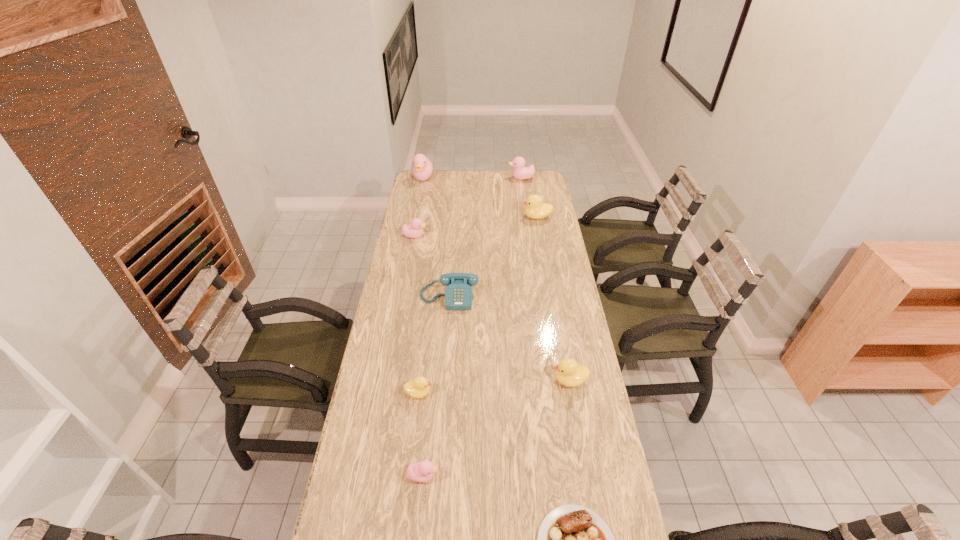
I want to click on free space at the far edge of the desktop, so click(x=466, y=172).

In order to click on vacant space at the left edge of the desktop in this screenshot , I will do `click(404, 346)`.

You are a GUI agent. You are given a task and a screenshot of the screen. Output one action in this format:
    pyautogui.click(x=<x>, y=<y>)
    Task: Click on the vacant space at the right edge of the desktop
    
    Given the screenshot: What is the action you would take?
    pyautogui.click(x=539, y=296)

This screenshot has height=540, width=960. In order to click on vacant space at the far left corner of the desktop in this screenshot , I will do `click(432, 188)`.

Image resolution: width=960 pixels, height=540 pixels. Identify the location of vacant region at the far right corner. (528, 182).

Locate an element on the screen. The height and width of the screenshot is (540, 960). vacant area between the second smallest yellow duckling and the fifth farthest object is located at coordinates (510, 339).

This screenshot has width=960, height=540. Identify the location of vacant space in between the fourth farthest duckling and the biggest pink duckling. (420, 207).

At what (x,y) coordinates should I click in order to perform the action: click on vacant space that's between the third farthest pink duckling and the leftmost yellow duckling. Please return your answer as a coordinate pair (x, y). Looking at the image, I should click on (417, 314).

You are a GUI agent. You are given a task and a screenshot of the screen. Output one action in this format:
    pyautogui.click(x=<x>, y=<y>)
    Task: Click on the empty space between the telephone and the sixth nearest object
    The image size is (960, 540).
    Given the screenshot: What is the action you would take?
    pyautogui.click(x=432, y=267)

The height and width of the screenshot is (540, 960). What are the coordinates of `unoccupied area between the fourth nearest duckling and the biggest pink duckling` in the screenshot? It's located at (420, 207).